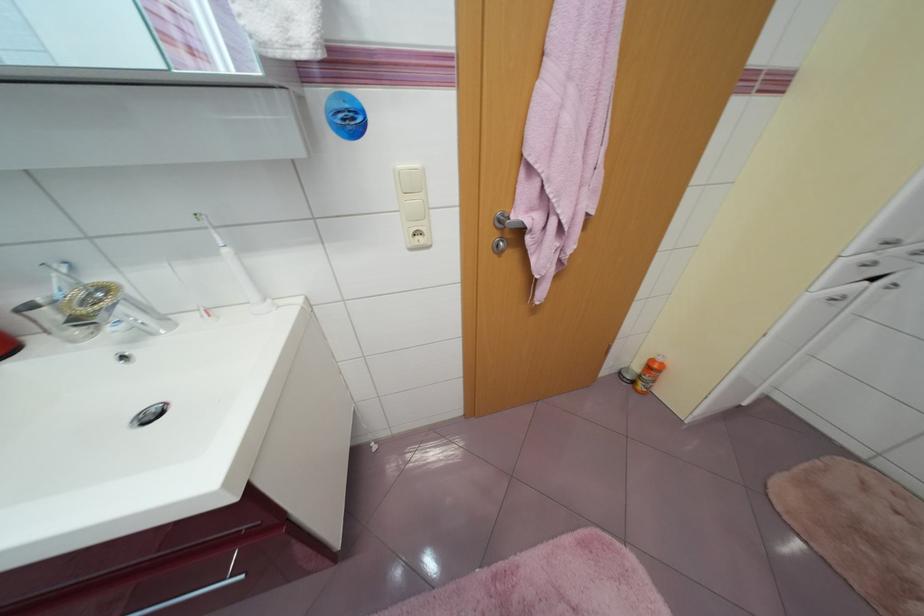
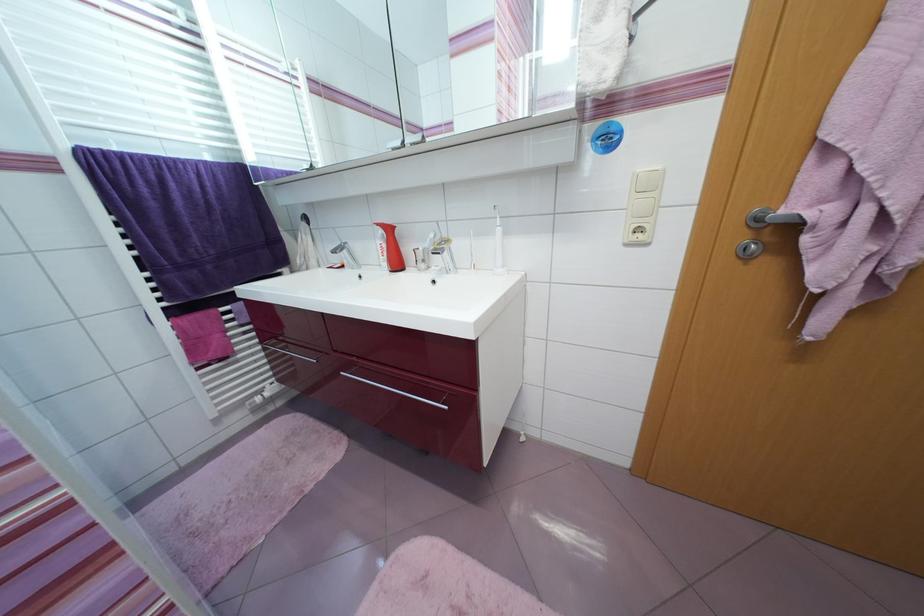
Question: The camera is either moving clockwise (left) or counter-clockwise (right) around the object. The first image is from the beginning of the video and the second image is from the end. Is the camera moving left or right when shooting the video?

Choices:
 (A) Left
 (B) Right

Answer: (B)